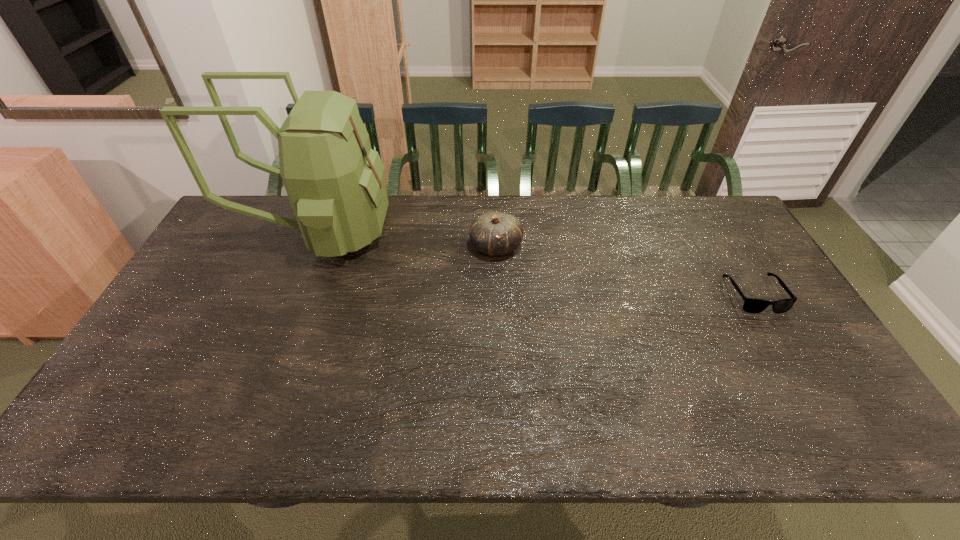
You are a GUI agent. You are given a task and a screenshot of the screen. Output one action in this format:
    pyautogui.click(x=<x>, y=<y>)
    Task: Click on the backpack
    This screenshot has height=540, width=960.
    Given the screenshot: What is the action you would take?
    pyautogui.click(x=335, y=182)

You are a GUI agent. You are given a task and a screenshot of the screen. Output one action in this format:
    pyautogui.click(x=<x>, y=<y>)
    Task: Click on the leftmost object
    
    Given the screenshot: What is the action you would take?
    pyautogui.click(x=335, y=182)

The height and width of the screenshot is (540, 960). In order to click on the second object from right to left in this screenshot , I will do `click(493, 233)`.

Find the location of a particular element. The height and width of the screenshot is (540, 960). the second shortest object is located at coordinates (493, 233).

Where is `the shortest object`? The width and height of the screenshot is (960, 540). the shortest object is located at coordinates (751, 305).

You are a GUI agent. You are given a task and a screenshot of the screen. Output one action in this format:
    pyautogui.click(x=<x>, y=<y>)
    Task: Click on the nearest object
    
    Given the screenshot: What is the action you would take?
    pyautogui.click(x=751, y=305)

Identify the location of free space located 0.050m on the front pocket of the backpack. This screenshot has width=960, height=540. (404, 232).

The width and height of the screenshot is (960, 540). Identify the location of free spot located on the front of the second object from right to left. (496, 275).

I want to click on vacant space situated 0.310m on the front-facing side of the shortest object, so click(828, 419).

Where is `backpack at the far edge`? Image resolution: width=960 pixels, height=540 pixels. backpack at the far edge is located at coordinates (335, 182).